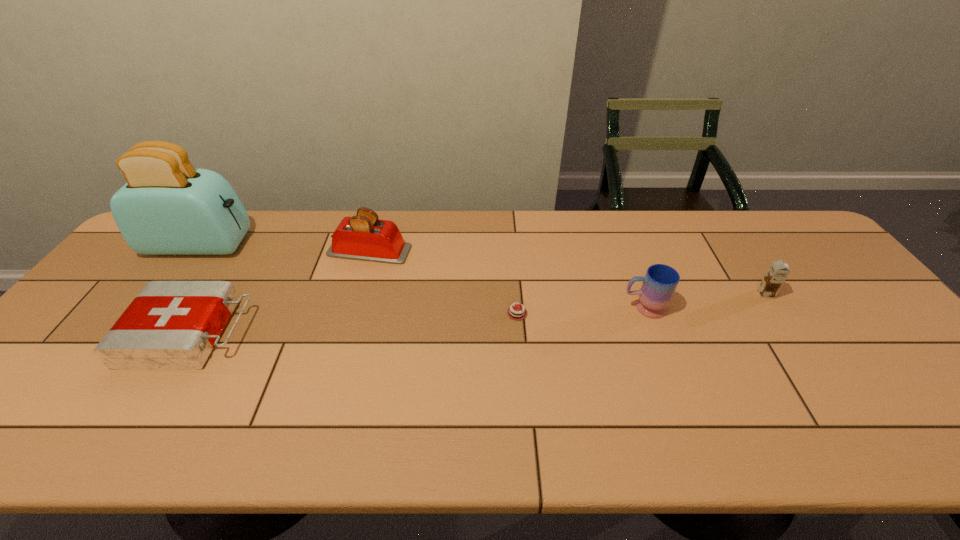
This screenshot has height=540, width=960. Identify the location of vacant point located 0.350m on the left of the fifth shortest object. (214, 251).

You are a GUI agent. You are given a task and a screenshot of the screen. Output one action in this format:
    pyautogui.click(x=<x>, y=<y>)
    Task: Click on the vacant space located 0.260m on the side of the fifth object from left to right with the handle
    This screenshot has width=960, height=540.
    Given the screenshot: What is the action you would take?
    pyautogui.click(x=524, y=308)

Locate an element on the screen. The image size is (960, 540). vacant space located 0.060m on the side of the fifth object from left to right with the handle is located at coordinates (599, 308).

Identify the location of free point located 0.240m on the side of the fifth object from left to right with the handle. pyautogui.click(x=532, y=308).

This screenshot has height=540, width=960. I want to click on free space located 0.230m on the left of the rightmost object, so click(x=675, y=294).

Identify the location of free region located 0.320m on the front side of the first-aid kit. The width and height of the screenshot is (960, 540). (373, 333).

The height and width of the screenshot is (540, 960). I want to click on vacant space situated on the right of the third object from right to left, so click(x=664, y=313).

What are the coordinates of `object present at the left edge` in the screenshot? It's located at (167, 207).

You are a GUI agent. You are given a task and a screenshot of the screen. Output one action in this format:
    pyautogui.click(x=<x>, y=<y>)
    Task: Click on the object at the far left corner
    The width and height of the screenshot is (960, 540).
    Given the screenshot: What is the action you would take?
    pos(167,207)

Image resolution: width=960 pixels, height=540 pixels. I want to click on free region at the far edge of the desktop, so click(445, 233).